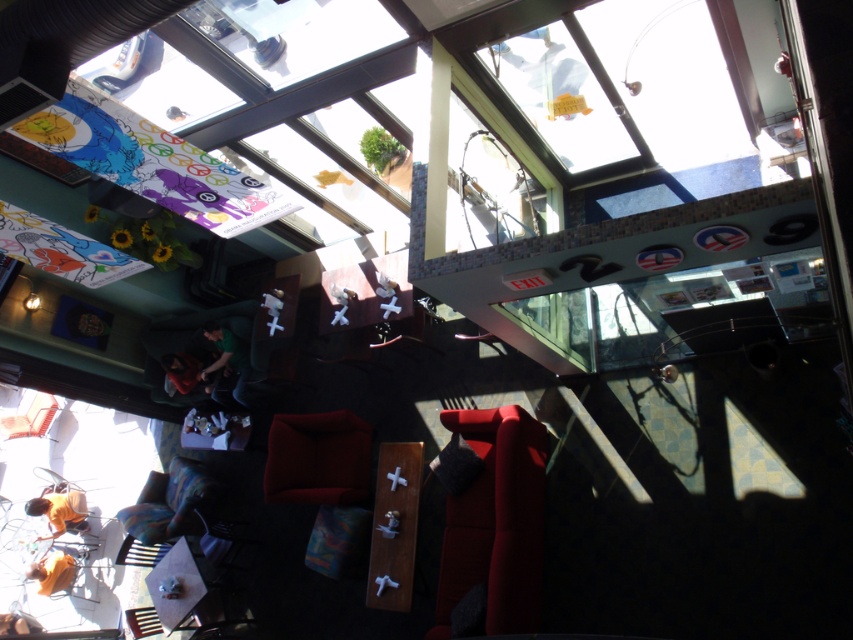
Does matte red chair at center appear over matte black shirt at lower left?

No.

Does matte red chair at center have a greater width compared to matte black shirt at lower left?

Yes, matte red chair at center is wider than matte black shirt at lower left.

Identify the location of matte red chair at center. The image size is (853, 640). (317, 458).

This screenshot has height=640, width=853. I want to click on matte red chair at center, so click(x=317, y=458).

Between orange fabric person at lower left and green matte shirt at lower left, which one is positioned lower?

orange fabric person at lower left is below.

Who is higher up, orange fabric person at lower left or green matte shirt at lower left?

green matte shirt at lower left is higher up.

The width and height of the screenshot is (853, 640). What do you see at coordinates (59, 512) in the screenshot?
I see `orange fabric person at lower left` at bounding box center [59, 512].

Locate an element on the screen. This screenshot has width=853, height=640. orange fabric person at lower left is located at coordinates (59, 512).

Does suede-like red chair at lower right appear over matte red chair at center?

No.

Can you confirm if suede-like red chair at lower right is wider than matte red chair at center?

Yes.

Where is `suede-like red chair at lower right`? suede-like red chair at lower right is located at coordinates (495, 522).